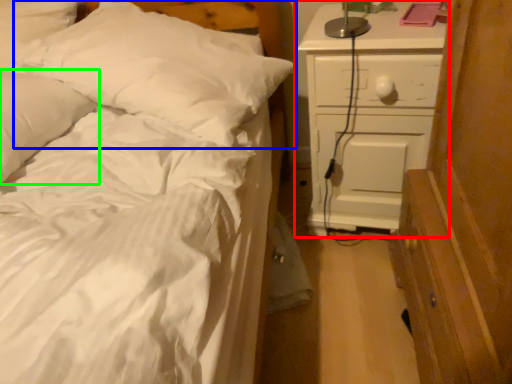
Question: Based on their relative distances, which object is farther from chest of drawers (highlighted by a red box)? Choose from pillow (highlighted by a blue box) and pillow (highlighted by a green box).

Choices:
 (A) pillow
 (B) pillow

Answer: (B)